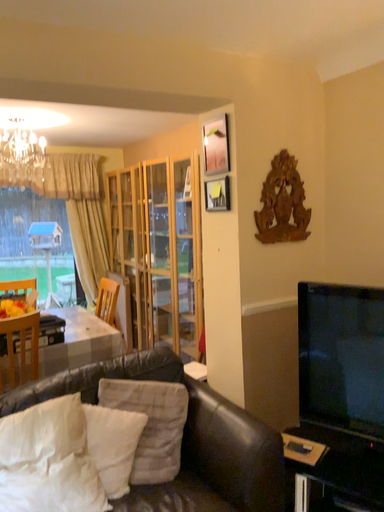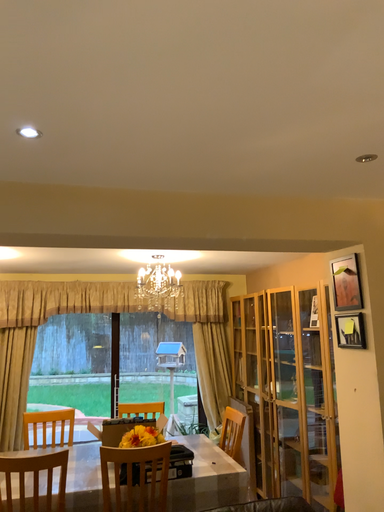
Question: How did the camera likely rotate when shooting the video?

Choices:
 (A) rotated downward
 (B) rotated upward

Answer: (B)